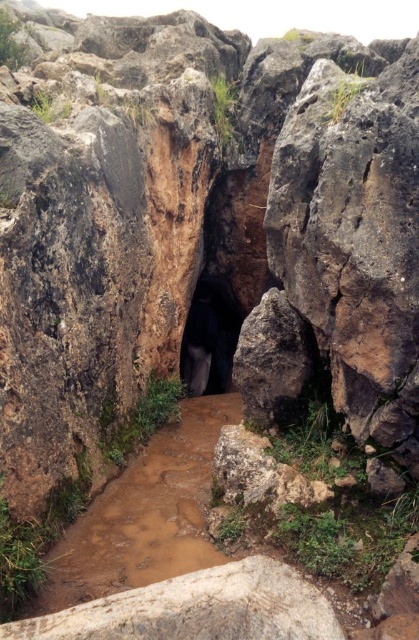
Can you confirm if brown muddy stream at center is smaller than black matte entrance at center?

No.

Who is more forward, [214,403] or [219,372]?

Point [214,403]

Find the location of a particular element. brown muddy stream at center is located at coordinates (144, 515).